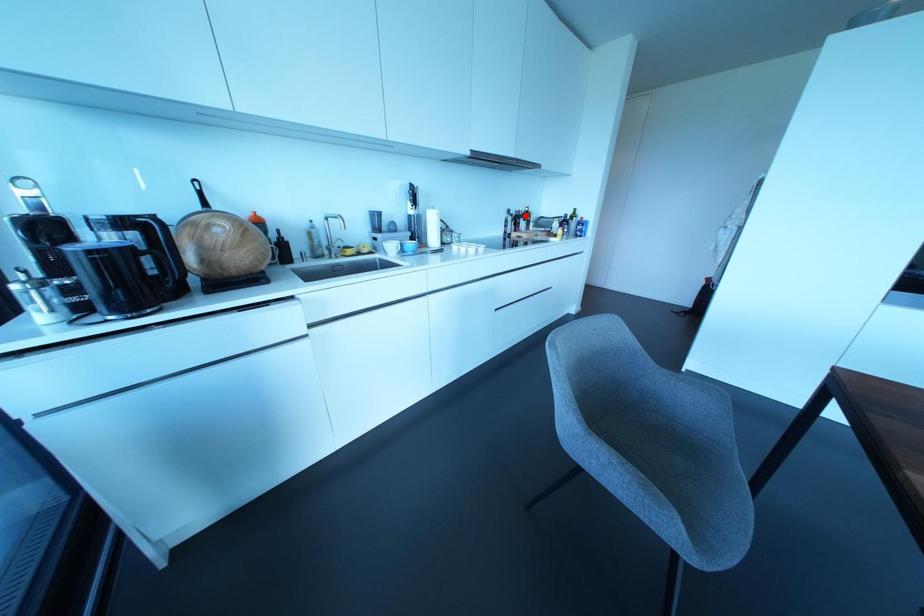
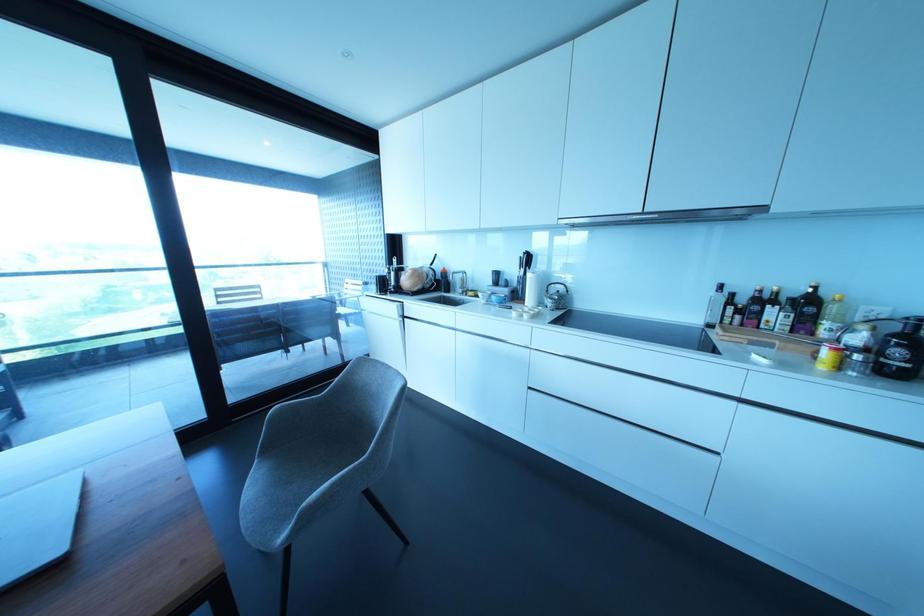
Find the pixel in the second image that matches the highlighted location in the first image.

(807, 304)